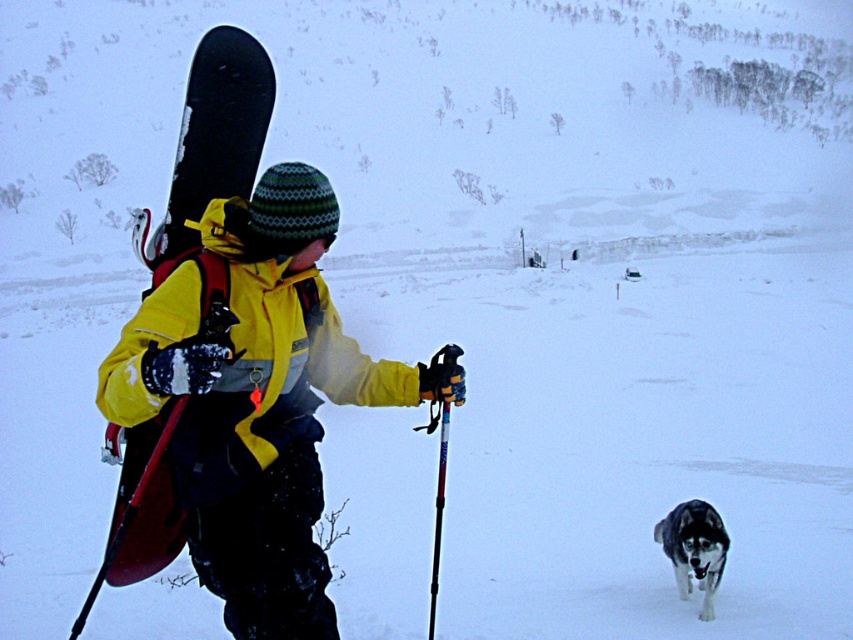
How far apart are yellow matte jacket at center and black fur dog at lower right?

yellow matte jacket at center and black fur dog at lower right are 21.09 feet apart from each other.

Between yellow matte jacket at center and black fur dog at lower right, which one appears on the right side from the viewer's perspective?

Positioned to the right is black fur dog at lower right.

The height and width of the screenshot is (640, 853). What do you see at coordinates (254, 396) in the screenshot?
I see `yellow matte jacket at center` at bounding box center [254, 396].

Image resolution: width=853 pixels, height=640 pixels. Find the location of `yellow matte jacket at center`. yellow matte jacket at center is located at coordinates (254, 396).

From the picture: Does matte black snowboard at left appear on the right side of black fur dog at lower right?

In fact, matte black snowboard at left is to the left of black fur dog at lower right.

Does matte black snowboard at left appear under black fur dog at lower right?

No.

Is point (256, 156) less distant than point (688, 584)?

Yes, point (256, 156) is in front of point (688, 584).

Identify the location of matte black snowboard at left. The image size is (853, 640). (212, 144).

Can you confirm if yellow matte jacket at center is smaller than matte black snowboard at left?

Yes, yellow matte jacket at center is smaller than matte black snowboard at left.

Between point (143, 310) and point (135, 513), which one is positioned behind?

The point (143, 310) is more distant.

Is point (254, 570) farther from viewer compared to point (267, 124)?

No, it is not.

Locate an element on the screen. yellow matte jacket at center is located at coordinates (254, 396).